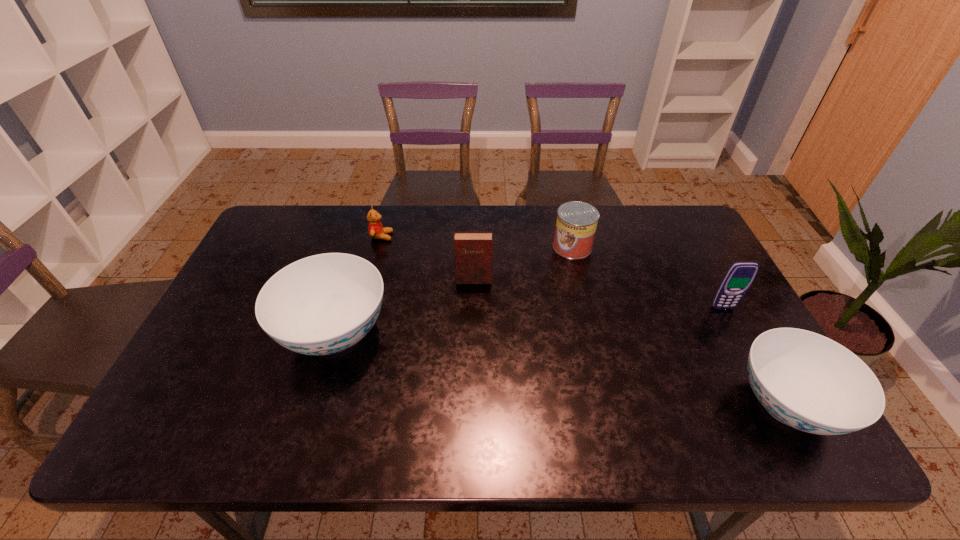
The height and width of the screenshot is (540, 960). In order to click on the third closest object to the cellular telephone in this screenshot , I will do `click(473, 251)`.

Identify which object is located as the second nearest to the cellular telephone. Please provide its 2D coordinates. Your answer should be formatted as a tuple, i.e. [(x, y)], where the tuple contains the x and y coordinates of a point satisfying the conditions above.

[(576, 224)]

At what (x,y) coordinates should I click in order to perform the action: click on free point that satisfies the following two spatial constraints: 1. on the back side of the third object from right to left; 2. on the front-facing side of the teddy bear. Please return your answer as a coordinate pair (x, y). The height and width of the screenshot is (540, 960). Looking at the image, I should click on (570, 237).

Image resolution: width=960 pixels, height=540 pixels. Find the location of `vacant region that satisfies the following two spatial constraints: 1. on the front-facing side of the teddy bear; 2. on the left side of the shorter chinaware`. vacant region that satisfies the following two spatial constraints: 1. on the front-facing side of the teddy bear; 2. on the left side of the shorter chinaware is located at coordinates (339, 405).

The image size is (960, 540). In order to click on free spot that satisfies the following two spatial constraints: 1. on the front-facing side of the shortest object; 2. on the right side of the shorter chinaware in this screenshot , I will do `click(339, 405)`.

This screenshot has width=960, height=540. In order to click on vacant point that satisfies the following two spatial constraints: 1. on the front-facing side of the can; 2. on the left side of the teddy bear in this screenshot , I will do `click(379, 247)`.

At what (x,y) coordinates should I click in order to perform the action: click on free region that satisfies the following two spatial constraints: 1. on the front-facing side of the third object from right to left; 2. on the left side of the shortest object. Please return your answer as a coordinate pair (x, y). The width and height of the screenshot is (960, 540). Looking at the image, I should click on (379, 247).